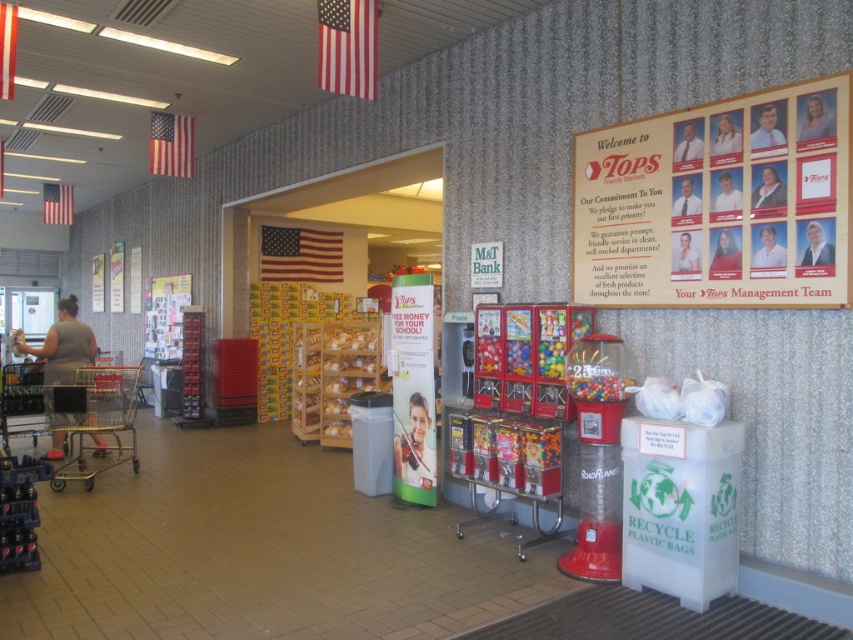
Between point (109, 449) and point (80, 349), which one is positioned behind?

The point (80, 349) is behind.

Does point (105, 387) lie in front of point (51, 353)?

Yes, it is in front of point (51, 353).

This screenshot has height=640, width=853. Describe the element at coordinates (96, 422) in the screenshot. I see `gold metallic shopping cart at left` at that location.

The height and width of the screenshot is (640, 853). Find the location of `gold metallic shopping cart at left`. gold metallic shopping cart at left is located at coordinates click(96, 422).

Is wooden framed poster at upper right above gold metallic shopping cart at left?

Indeed, wooden framed poster at upper right is positioned over gold metallic shopping cart at left.

Is wooden framed poster at upper right smaller than gold metallic shopping cart at left?

Yes, wooden framed poster at upper right is smaller than gold metallic shopping cart at left.

Image resolution: width=853 pixels, height=640 pixels. Describe the element at coordinates (718, 204) in the screenshot. I see `wooden framed poster at upper right` at that location.

The height and width of the screenshot is (640, 853). I want to click on wooden framed poster at upper right, so click(x=718, y=204).

Can you confirm if wooden framed poster at upper right is positioned to the right of gray fabric shirt at left?

Correct, you'll find wooden framed poster at upper right to the right of gray fabric shirt at left.

Consider the image. Who is shorter, wooden framed poster at upper right or gray fabric shirt at left?

With less height is gray fabric shirt at left.

You are a GUI agent. You are given a task and a screenshot of the screen. Output one action in this format:
    pyautogui.click(x=<x>, y=<y>)
    Task: Click on the wooden framed poster at upper right
    Image resolution: width=853 pixels, height=640 pixels.
    Given the screenshot: What is the action you would take?
    pyautogui.click(x=718, y=204)